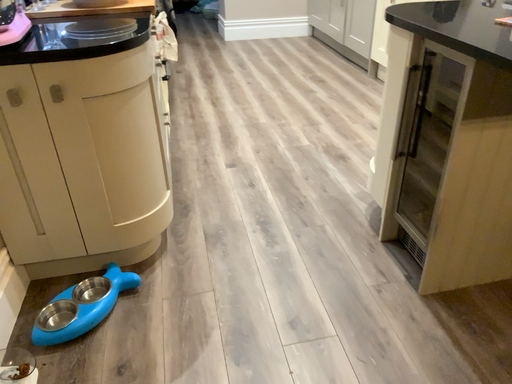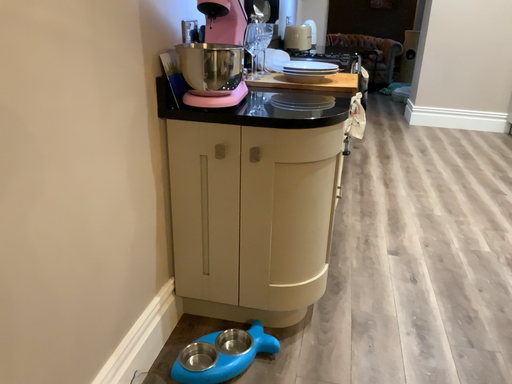
Question: How did the camera likely rotate when shooting the video?

Choices:
 (A) rotated right
 (B) rotated left

Answer: (B)